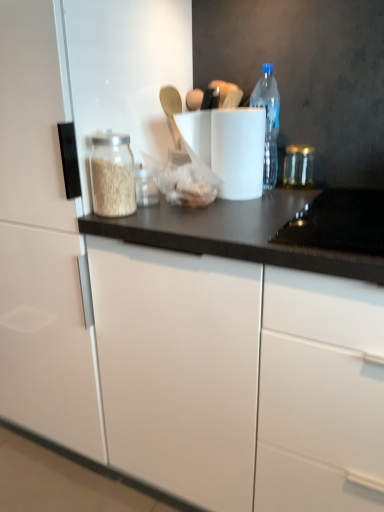
Locate an element on the screen. white glossy cabinet at left is located at coordinates (42, 245).

The height and width of the screenshot is (512, 384). In order to click on transparent glass jar at right in this screenshot , I will do `click(298, 166)`.

From a real-world perspective, between white matte paper towel at center and transparent plastic bottle at upper right, who is vertically higher?

transparent plastic bottle at upper right, from a real-world perspective.

Is white matte paper towel at center with transparent plastic bottle at upper right?

No, white matte paper towel at center is not next to transparent plastic bottle at upper right.

How many degrees apart are the facing directions of white matte paper towel at center and transparent plastic bottle at upper right?

The facing directions of white matte paper towel at center and transparent plastic bottle at upper right are 6.94 degrees apart.

From the image's perspective, which object appears higher, white matte paper towel at center or transparent plastic bottle at upper right?

transparent plastic bottle at upper right, from the image's perspective.

Is white matte paper towel at center with white glossy cabinet at left?

white matte paper towel at center and white glossy cabinet at left are clearly separated.

Relative to white glossy cabinet at left, is white matte paper towel at center in front or behind?

white matte paper towel at center is behind white glossy cabinet at left.

Between white matte paper towel at center and white glossy cabinet at left, which one has larger width?

With larger width is white glossy cabinet at left.

Is point (271, 166) behind point (284, 170)?

That is False.

Is transparent glass jar at right a part of transparent plastic bottle at upper right?

No, transparent glass jar at right is not inside transparent plastic bottle at upper right.

Is white glossy cabinet at left not near transparent plastic bottle at upper right?

No, there isn't a large distance between white glossy cabinet at left and transparent plastic bottle at upper right.

Would you say transparent plastic bottle at upper right is part of white glossy cabinet at left's contents?

No, transparent plastic bottle at upper right is not a part of white glossy cabinet at left.

Does white glossy cabinet at left turn towards transparent plastic bottle at upper right?

No, white glossy cabinet at left is not aimed at transparent plastic bottle at upper right.

You are a GUI agent. You are given a task and a screenshot of the screen. Output one action in this format:
    pyautogui.click(x=<x>, y=<y>)
    Task: Click on the bottle above the white glossy cabinet at left (from the image's perspective)
    The image size is (384, 512).
    Given the screenshot: What is the action you would take?
    pyautogui.click(x=268, y=121)

Could you tell me if transparent plastic bottle at upper right is turned towards white glossy cabinet at left?

No, transparent plastic bottle at upper right is not turned towards white glossy cabinet at left.

Is transparent plastic bottle at upper right shorter than white glossy cabinet at left?

Correct, transparent plastic bottle at upper right is not as tall as white glossy cabinet at left.

Measure the distance between transparent plastic bottle at upper right and white glossy cabinet at left.

The distance of transparent plastic bottle at upper right from white glossy cabinet at left is 25.65 inches.

From a real-world perspective, is white glossy cabinet at left above or below white matte paper towel at center?

Clearly, from a real-world perspective, white glossy cabinet at left is below white matte paper towel at center.

Considering the relative positions of white glossy cabinet at left and white matte paper towel at center in the image provided, is white glossy cabinet at left to the left or to the right of white matte paper towel at center?

In the image, white glossy cabinet at left appears on the left side of white matte paper towel at center.

How far apart are white glossy cabinet at left and white matte paper towel at center?

white glossy cabinet at left is 19.10 inches from white matte paper towel at center.

Where is `cabinetry on the left of the white matte paper towel at center`? cabinetry on the left of the white matte paper towel at center is located at coordinates (42, 245).

Between transparent glass jar at right and white matte paper towel at center, which one appears on the right side from the viewer's perspective?

transparent glass jar at right is more to the right.

Is transparent glass jar at right oriented away from white matte paper towel at center?

transparent glass jar at right does not have its back to white matte paper towel at center.

Considering their positions, is transparent glass jar at right located in front of or behind white matte paper towel at center?

transparent glass jar at right is behind white matte paper towel at center.

From the picture: From the image's perspective, is transparent glass jar at right located beneath white matte paper towel at center?

Indeed, from the image's perspective, transparent glass jar at right is shown beneath white matte paper towel at center.

Locate an element on the screen. This screenshot has height=512, width=384. paper towel in front of the transparent plastic bottle at upper right is located at coordinates (227, 148).

You are a GUI agent. You are given a task and a screenshot of the screen. Output one action in this format:
    pyautogui.click(x=<x>, y=<y>)
    Task: Click on the cabinetry below the white matte paper towel at center (from a real-world perspective)
    
    Given the screenshot: What is the action you would take?
    pyautogui.click(x=42, y=245)

Which object lies further to the anchor point transparent glass jar at right, white glossy cabinet at left or transparent plastic bottle at upper right?

Among the two, white glossy cabinet at left is located further to transparent glass jar at right.

Looking at the image, which one is located closer to transparent plastic bottle at upper right, white matte paper towel at center or transparent glass jar at right?

Among the two, white matte paper towel at center is located nearer to transparent plastic bottle at upper right.

From the picture: Looking at the image, which one is located further to white matte paper towel at center, white glossy cabinet at left or transparent glass jar at right?

The object further to white matte paper towel at center is white glossy cabinet at left.

Looking at the image, which one is located closer to white glossy cabinet at left, transparent plastic bottle at upper right or white matte paper towel at center?

Based on the image, white matte paper towel at center appears to be nearer to white glossy cabinet at left.

Which object lies further to the anchor point white matte paper towel at center, transparent plastic bottle at upper right or white glossy cabinet at left?

white glossy cabinet at left lies further to white matte paper towel at center than the other object.

Based on their spatial positions, is transparent glass jar at right or transparent plastic bottle at upper right closer to white matte paper towel at center?

Based on the image, transparent plastic bottle at upper right appears to be nearer to white matte paper towel at center.

Based on their spatial positions, is transparent plastic bottle at upper right or transparent glass jar at right further from white matte paper towel at center?

transparent glass jar at right lies further to white matte paper towel at center than the other object.

In the scene shown: Estimate the real-world distances between objects in this image. Which object is closer to white glossy cabinet at left, transparent glass jar at right or white matte paper towel at center?

white matte paper towel at center is positioned closer to the anchor white glossy cabinet at left.

Where is `paper towel between white glossy cabinet at left and transparent glass jar at right from left to right`? Image resolution: width=384 pixels, height=512 pixels. paper towel between white glossy cabinet at left and transparent glass jar at right from left to right is located at coordinates (227, 148).

Where is `bottle between white glossy cabinet at left and transparent glass jar at right from left to right`? The image size is (384, 512). bottle between white glossy cabinet at left and transparent glass jar at right from left to right is located at coordinates (268, 121).

Find the location of a particular element. This screenshot has width=384, height=512. paper towel situated between white glossy cabinet at left and transparent plastic bottle at upper right from left to right is located at coordinates (227, 148).

Image resolution: width=384 pixels, height=512 pixels. I want to click on bottle situated between white matte paper towel at center and transparent glass jar at right from left to right, so click(x=268, y=121).